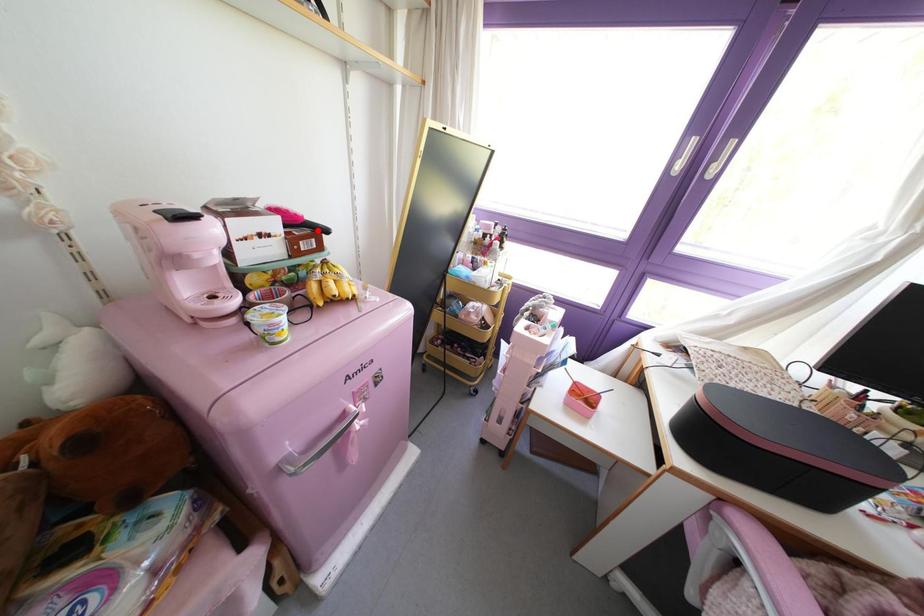
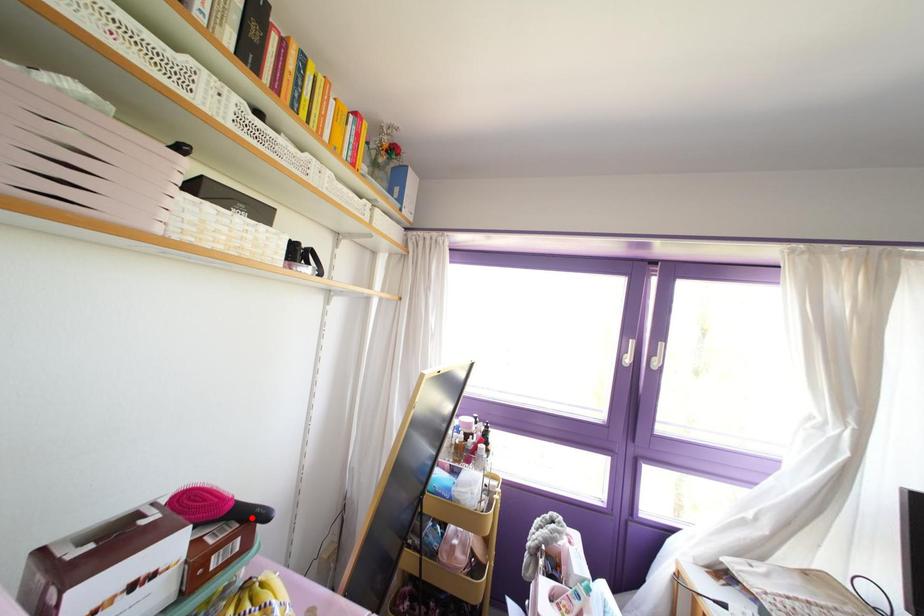
I am providing you with two images of the same scene from different viewpoints. A red point is marked on the first image and another point is marked on the second image. Are the points marked in image1 and image2 representing the same 3D position?

Yes